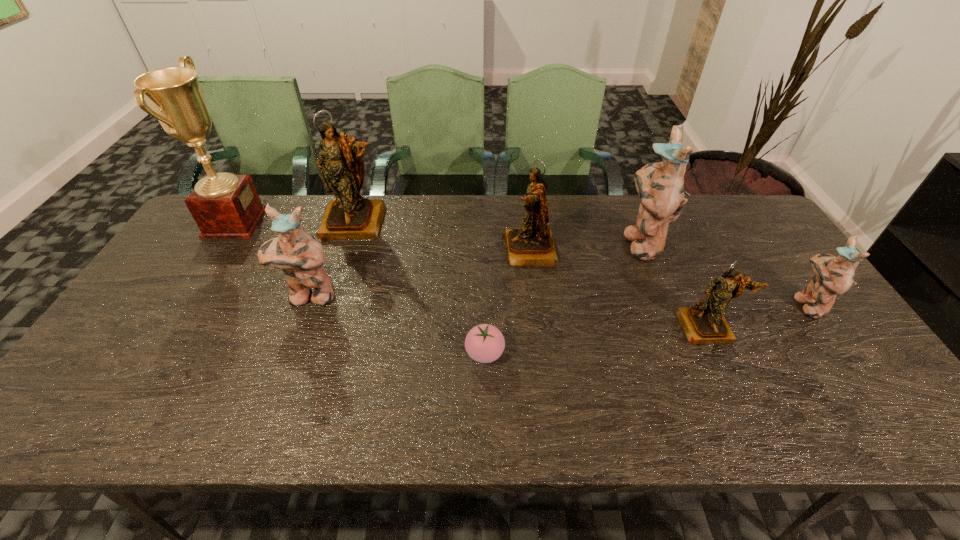
This screenshot has height=540, width=960. I want to click on object located in the right edge section of the desktop, so click(833, 276).

What are the coordinates of `object that is at the far left corner` in the screenshot? It's located at (224, 205).

The width and height of the screenshot is (960, 540). What are the coordinates of `blank space at the near edge` in the screenshot? It's located at (453, 401).

In the image, there is a desktop. Where is `vacant space at the left edge`? This screenshot has width=960, height=540. vacant space at the left edge is located at coordinates (157, 329).

Where is `vacant region at the right edge`? The width and height of the screenshot is (960, 540). vacant region at the right edge is located at coordinates (822, 357).

What are the coordinates of `empty space between the fourth object from left to right and the leftmost gold figurine` in the screenshot? It's located at (420, 288).

The image size is (960, 540). I want to click on unoccupied position between the leftmost pink figurine and the leftmost gold figurine, so click(x=332, y=260).

Where is `vacant area that lies between the biggest pink figurine and the nearest gold figurine`? vacant area that lies between the biggest pink figurine and the nearest gold figurine is located at coordinates (674, 285).

The image size is (960, 540). Find the location of `empty space that is in between the red tomato and the smallest gold figurine`. empty space that is in between the red tomato and the smallest gold figurine is located at coordinates (596, 340).

You are a GUI agent. You are given a task and a screenshot of the screen. Output one action in this format:
    pyautogui.click(x=<x>, y=<y>)
    Task: Click on the vacant point located between the rightmost figurine and the leftmost pink figurine
    
    Given the screenshot: What is the action you would take?
    pyautogui.click(x=559, y=301)